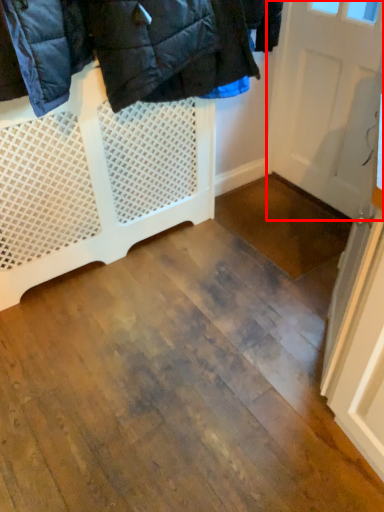
Question: From the image's perspective, where is door (annotated by the red box) located relative to furniture?

Choices:
 (A) above
 (B) below

Answer: (A)